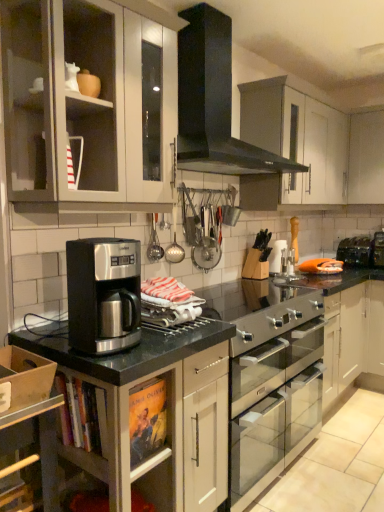
Question: From a real-world perspective, relative to matte white cabinet at upper left, the 1th cabinetry positioned from the left, is satin black coffee maker at center vertically above or below?

Choices:
 (A) below
 (B) above

Answer: (A)

Question: From the image's perspective, is satin black coffee maker at center above or below matte white cabinet at upper left, which is the 2th cabinetry in top-to-bottom order?

Choices:
 (A) above
 (B) below

Answer: (B)

Question: Which object is the closest to the matte white cabinet at upper left, which is the 3th cabinetry in right-to-left order?

Choices:
 (A) satin silver oven at center, which is counted as the 1th appliance, starting from the front
 (B) satin silver cabinet at lower left, the third cabinetry from the top
 (C) white matte cabinet at upper right, which is the 1th cabinetry in right-to-left order
 (D) black metallic toaster at right, the 1th appliance from the back
 (E) black matte gas stove at upper center

Answer: (E)

Question: Which is farther from the black matte gas stove at upper center?

Choices:
 (A) satin silver oven at center, positioned as the second appliance in right-to-left order
 (B) satin silver cabinet at lower left, which is the 1th cabinetry in front-to-back order
 (C) white matte cabinet at upper right, the 1th cabinetry positioned from the top
 (D) satin black coffee maker at center
 (E) black metallic toaster at right, acting as the second appliance starting from the bottom

Answer: (E)